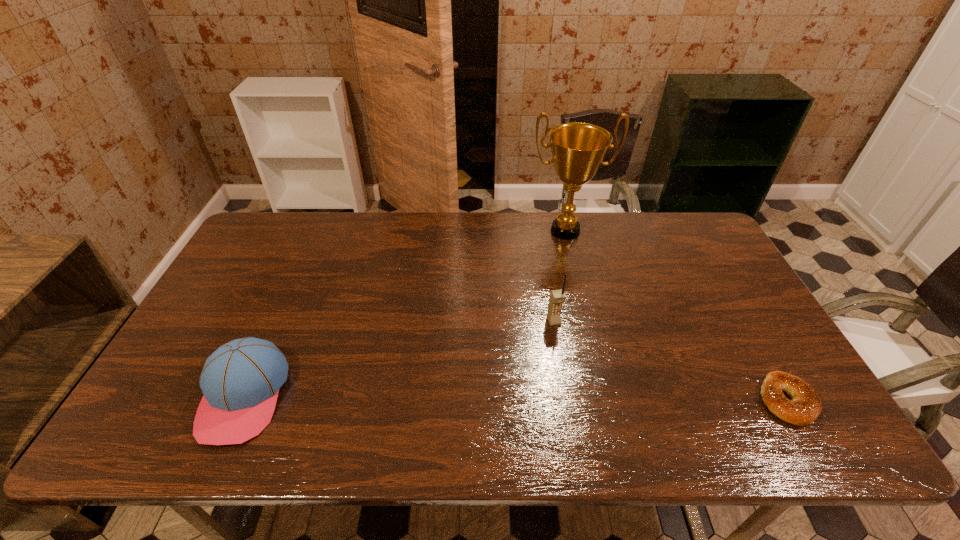
This screenshot has width=960, height=540. I want to click on free space between the baseball cap and the rightmost object, so click(x=516, y=398).

The image size is (960, 540). Find the location of `free space between the bagel and the third shortest object`. free space between the bagel and the third shortest object is located at coordinates (670, 361).

Find the location of a particular element. This screenshot has height=540, width=960. vacant space in between the tallest object and the baseball cap is located at coordinates (405, 314).

You are a GUI agent. You are given a task and a screenshot of the screen. Output one action in this format:
    pyautogui.click(x=<x>, y=<y>)
    Task: Click on the vacant space in between the award and the leftmost object
    The width and height of the screenshot is (960, 540).
    Given the screenshot: What is the action you would take?
    pyautogui.click(x=405, y=314)

Where is `blank region between the baseball cap and the rightmost object`? The height and width of the screenshot is (540, 960). blank region between the baseball cap and the rightmost object is located at coordinates (516, 398).

Where is `vacant area that lies between the shortest object and the tallest object`? vacant area that lies between the shortest object and the tallest object is located at coordinates (676, 316).

Where is `vacant space that is in between the rightmost object and the second farthest object`? The height and width of the screenshot is (540, 960). vacant space that is in between the rightmost object and the second farthest object is located at coordinates (670, 361).

The height and width of the screenshot is (540, 960). What are the coordinates of `free space between the rightmost object and the farthest object` in the screenshot? It's located at (676, 316).

The image size is (960, 540). What are the coordinates of `object that is the closest one to the second tallest object` in the screenshot? It's located at (578, 149).

Identify which object is the second nearest to the shortest object. Please provide its 2D coordinates. Your answer should be formatted as a tuple, i.e. [(x, y)], where the tuple contains the x and y coordinates of a point satisfying the conditions above.

[(578, 149)]